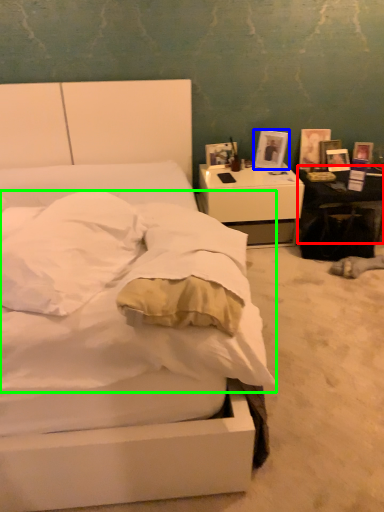
Question: Which object is the farthest from table (highlighted by a red box)? Choose among these: picture frame (highlighted by a blue box) or mattress (highlighted by a green box).

Choices:
 (A) picture frame
 (B) mattress

Answer: (B)